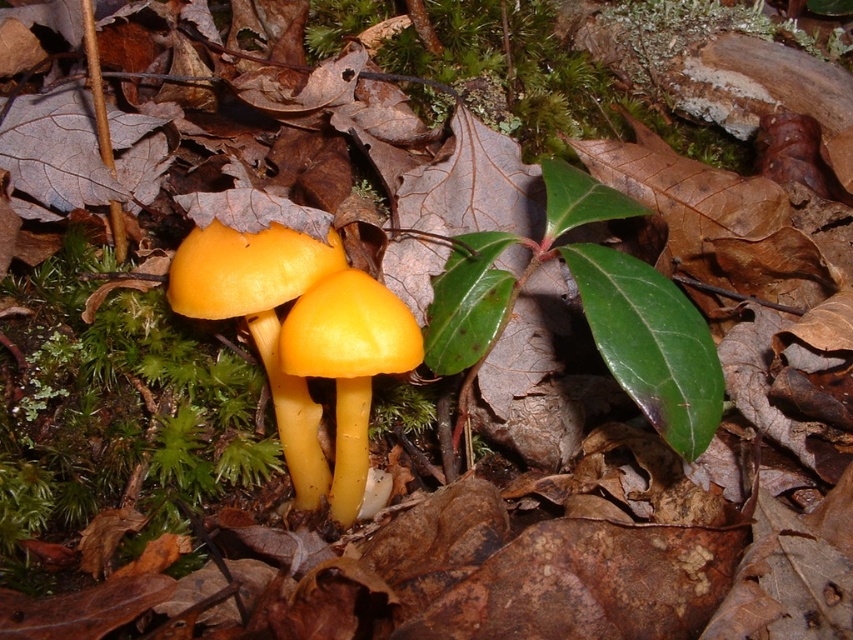
Is yellow smooth mushrooms at center bigger than yellow smooth mushroom at center?

Correct, yellow smooth mushrooms at center is larger in size than yellow smooth mushroom at center.

Does yellow smooth mushrooms at center appear on the left side of yellow smooth mushroom at center?

Correct, you'll find yellow smooth mushrooms at center to the left of yellow smooth mushroom at center.

Who is more distant from viewer, (186,294) or (393,310)?

Point (393,310)

Where is `yellow smooth mushrooms at center`? The image size is (853, 640). yellow smooth mushrooms at center is located at coordinates (262, 321).